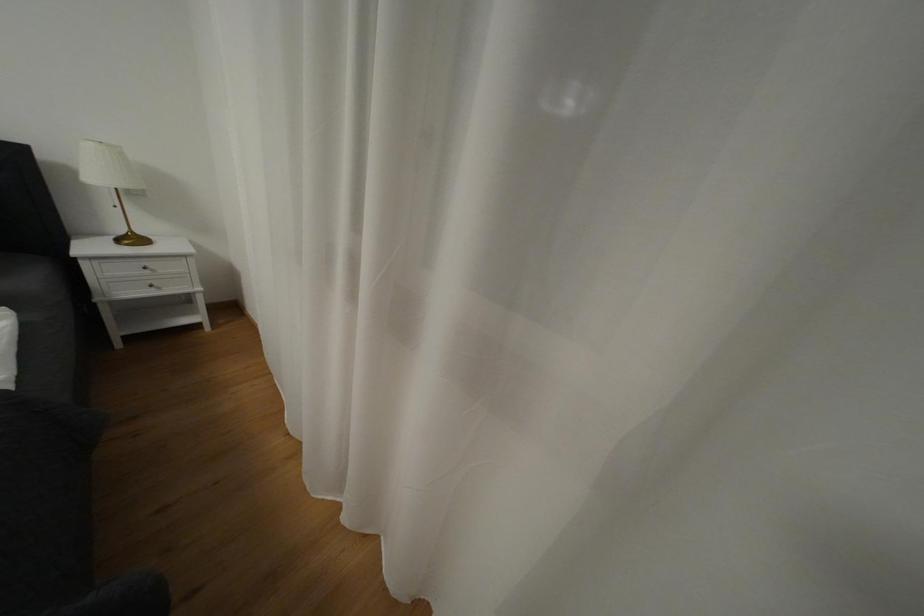
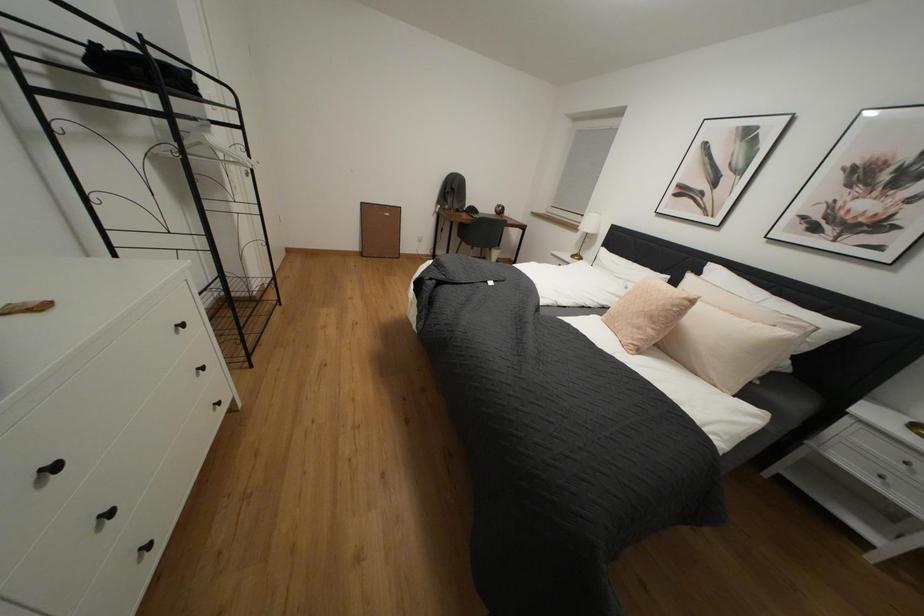
Looking at this image, first-person continuous shooting, in which direction is the camera rotating?

The camera rotated toward left-down.